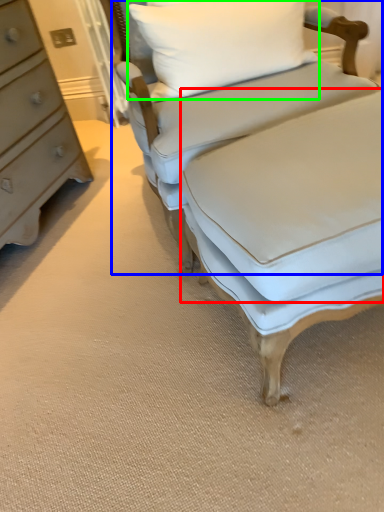
Question: Based on their relative distances, which object is nearer to sheet (highlighted by a red box)? Choose from studio couch (highlighted by a blue box) and pillow (highlighted by a green box).

Choices:
 (A) studio couch
 (B) pillow

Answer: (A)